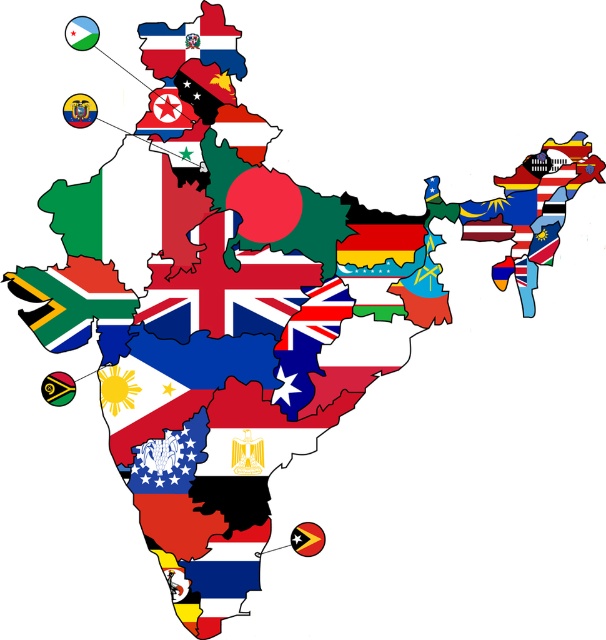
You are looking at the map of India with various national flags representing its states. There are two points on the map labeled as point 1 at coordinates (48, 310) and point 2 at coordinates (227, 33). Which point is closer to you?

Point 1 at coordinates (48, 310) is closer to you because it is further to the camera than point 2 at coordinates (227, 33).

You are an art curator planning to display this map in a gallery. The gallery has a rule that any two flags displayed must be at least 10 inches apart to avoid visual clutter. Given the blue and white striped flag at bottom left and the matte red flag at upper center, will their current placement comply with the gallery rule?

The blue and white striped flag at bottom left is 8.22 inches from the matte red flag at upper center. Since 8.22 inches is less than the required 10 inches, their current placement does not comply with the gallery rule.

You are a geography student analyzing the map. You notice two specific flags on the map of India. The first is the blue and white striped flag at bottom left, and the second is the matte red flag at upper center. Based on their positions, which flag is positioned lower on the map?

The blue and white striped flag at bottom left is located below the matte red flag at upper center, so it is positioned lower on the map.